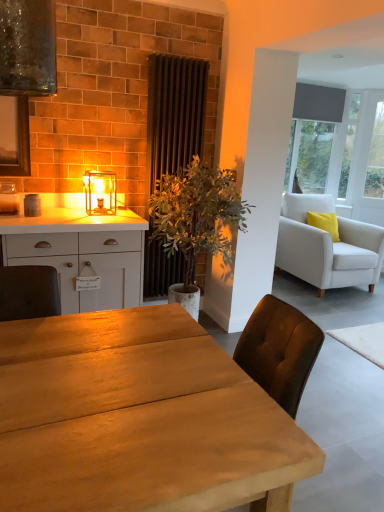
Question: Does matte glass lantern at center have a lesser width compared to white fabric armchair at right?

Choices:
 (A) yes
 (B) no

Answer: (A)

Question: From a real-world perspective, is matte glass lantern at center located beneath white fabric armchair at right?

Choices:
 (A) yes
 (B) no

Answer: (B)

Question: Is matte glass lantern at center positioned in front of white fabric armchair at right?

Choices:
 (A) no
 (B) yes

Answer: (B)

Question: Is matte glass lantern at center completely or partially outside of white fabric armchair at right?

Choices:
 (A) no
 (B) yes

Answer: (B)

Question: Considering the relative sizes of matte glass lantern at center and white fabric armchair at right in the image provided, is matte glass lantern at center shorter than white fabric armchair at right?

Choices:
 (A) no
 (B) yes

Answer: (B)

Question: In terms of width, does matte glass lantern at center look wider or thinner when compared to matte gray shade at upper right?

Choices:
 (A) wide
 (B) thin

Answer: (A)

Question: From the image's perspective, is matte glass lantern at center above or below matte gray shade at upper right?

Choices:
 (A) below
 (B) above

Answer: (A)

Question: Is matte glass lantern at center to the left or to the right of matte gray shade at upper right in the image?

Choices:
 (A) left
 (B) right

Answer: (A)

Question: Looking at the image, does matte glass lantern at center seem bigger or smaller compared to matte gray shade at upper right?

Choices:
 (A) big
 (B) small

Answer: (B)

Question: Would you say green leafy plant at center is to the left or to the right of white fabric armchair at right in the picture?

Choices:
 (A) left
 (B) right

Answer: (A)

Question: From a real-world perspective, is green leafy plant at center physically located above or below white fabric armchair at right?

Choices:
 (A) above
 (B) below

Answer: (A)

Question: Looking at their shapes, would you say green leafy plant at center is wider or thinner than white fabric armchair at right?

Choices:
 (A) wide
 (B) thin

Answer: (B)

Question: Would you say green leafy plant at center is inside or outside white fabric armchair at right?

Choices:
 (A) outside
 (B) inside

Answer: (A)

Question: Is dark brown fabric radiator at center situated inside matte glass lantern at center or outside?

Choices:
 (A) outside
 (B) inside

Answer: (A)

Question: In terms of size, does dark brown fabric radiator at center appear bigger or smaller than matte glass lantern at center?

Choices:
 (A) big
 (B) small

Answer: (A)